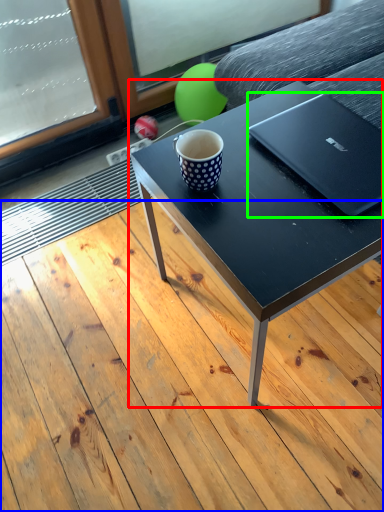
Question: Which object is positioned farthest from coffee table (highlighted by a red box)? Select from plank (highlighted by a blue box) and laptop (highlighted by a green box).

Choices:
 (A) plank
 (B) laptop

Answer: (A)